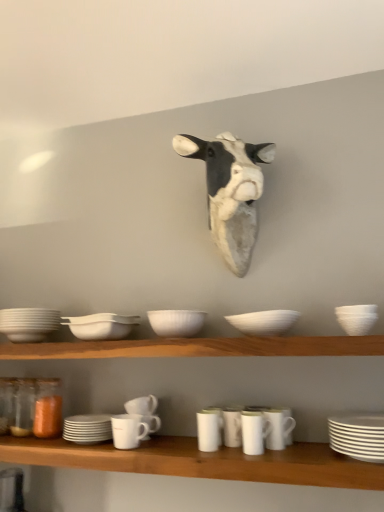
The image size is (384, 512). I want to click on free spot to the left of white glossy mug at center, which is the 4th tableware in right-to-left order, so click(174, 444).